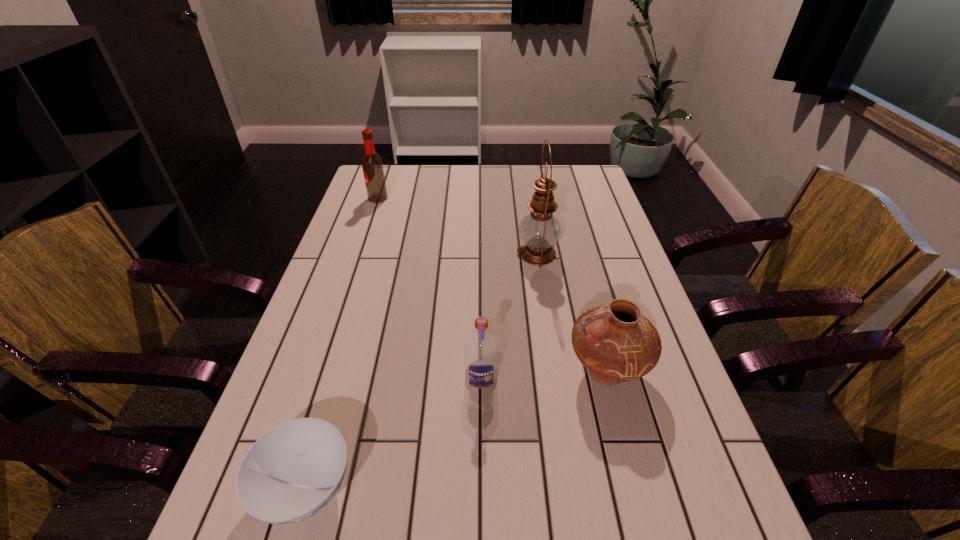
You are a GUI agent. You are given a task and a screenshot of the screen. Output one action in this format:
    pyautogui.click(x=<x>, y=<y>)
    Task: Click on the tallest object
    This screenshot has width=960, height=540.
    Given the screenshot: What is the action you would take?
    pyautogui.click(x=539, y=230)

Identify the location of the second farthest object. (539, 230).

At what (x,y) coordinates should I click in order to perform the action: click on beer bottle. Please return your answer as a coordinate pair (x, y). The height and width of the screenshot is (540, 960). Looking at the image, I should click on (372, 165).

Where is `the second tallest object`? the second tallest object is located at coordinates (372, 165).

I want to click on pottery, so click(x=616, y=343).

Locate an element on the screen. the third object from right to left is located at coordinates (481, 348).

Image resolution: width=960 pixels, height=540 pixels. I want to click on vacant region located 0.110m on the right of the tallest object, so click(595, 254).

Locate an element on the screen. vacant area situated 0.290m on the right of the farthest object is located at coordinates (x=471, y=198).

Identify the location of free spot located on the side of the pottery with the handle. (490, 371).

Locate an element on the screen. Image resolution: width=960 pixels, height=540 pixels. free space located 0.160m on the side of the pottery with the handle is located at coordinates (494, 371).